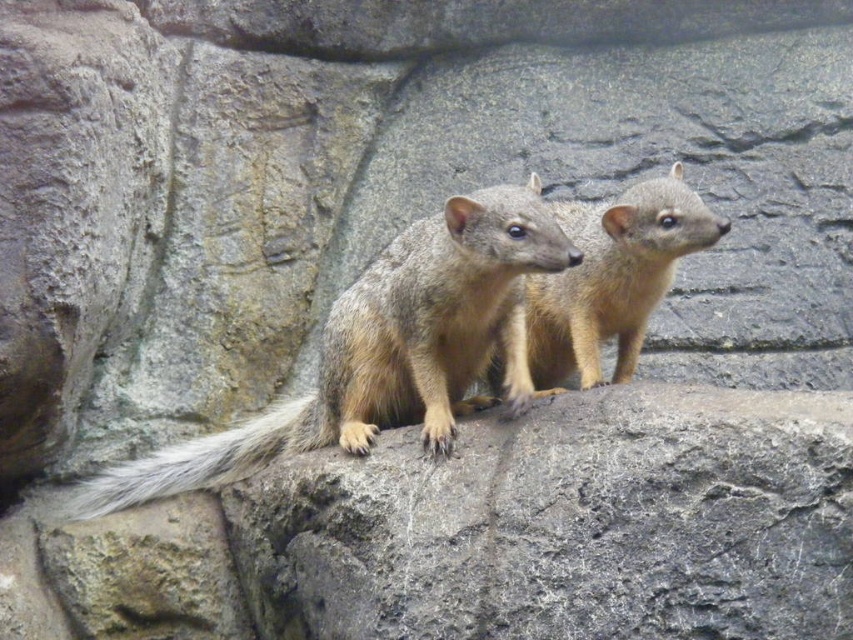
Is gray-furred squirrel at center thinner than white fluffy tail at center?

No.

Between gray-furred squirrel at center and white fluffy tail at center, which one is positioned higher?

gray-furred squirrel at center

Who is more forward, (473, 340) or (187, 467)?

Point (473, 340)

At what (x,y) coordinates should I click in order to perform the action: click on gray-furred squirrel at center. Please return your answer as a coordinate pair (x, y). The width and height of the screenshot is (853, 640). Looking at the image, I should click on (386, 348).